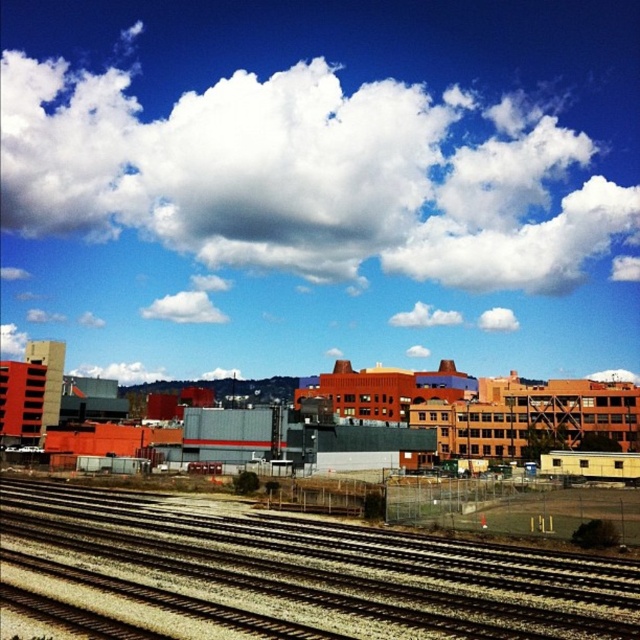
Question: Does white fluffy cloud at upper center lie in front of brown gravel tracks at lower center?

Choices:
 (A) yes
 (B) no

Answer: (B)

Question: Is white fluffy cloud at upper center closer to the viewer compared to brown gravel tracks at lower center?

Choices:
 (A) no
 (B) yes

Answer: (A)

Question: Which point is farther to the camera?

Choices:
 (A) brown gravel tracks at lower center
 (B) white fluffy cloud at upper center

Answer: (B)

Question: Does white fluffy cloud at upper center come behind brown gravel tracks at lower center?

Choices:
 (A) yes
 (B) no

Answer: (A)

Question: Which of the following is the farthest from the observer?

Choices:
 (A) brown gravel tracks at lower center
 (B) white fluffy cloud at upper center

Answer: (B)

Question: Which point is closer to the camera?

Choices:
 (A) (376, 90)
 (B) (93, 561)

Answer: (B)